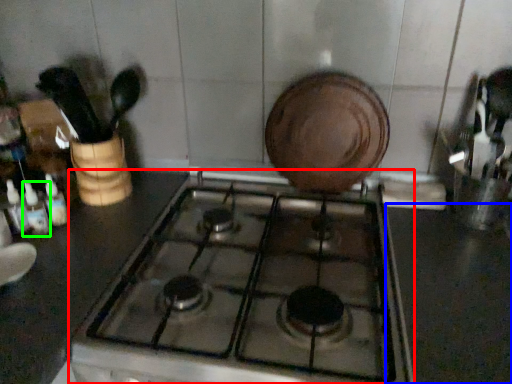
Question: Considering the real-world distances, which object is closest to gas stove (highlighted by a red box)? counter top (highlighted by a blue box) or bottle (highlighted by a green box).

Choices:
 (A) counter top
 (B) bottle

Answer: (A)